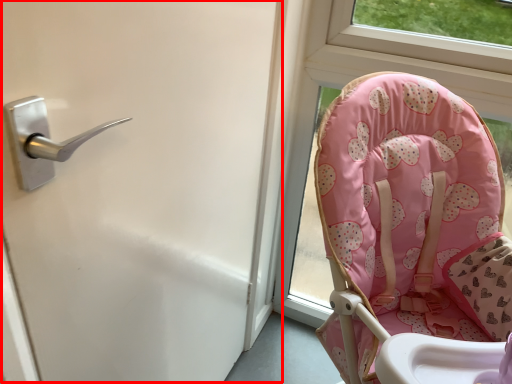
Question: From the image's perspective, what is the correct spatial positioning of screen door (annotated by the red box) in reference to chair?

Choices:
 (A) above
 (B) below

Answer: (B)